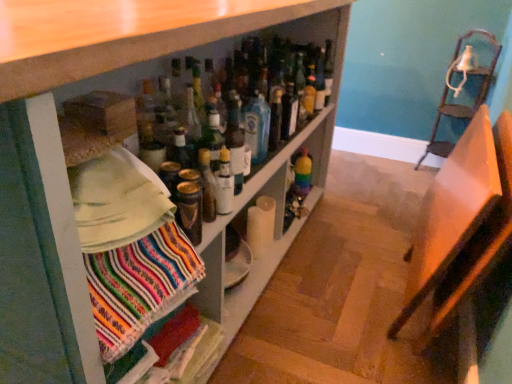
Question: From a real-world perspective, is rainbow glass bottle at center, arranged as the 4th bottle when viewed from the left, located beneath black glass bottle at center, placed as the 2th bottle when sorted from right to left?

Choices:
 (A) yes
 (B) no

Answer: (A)

Question: Can black glass bottle at center, acting as the third bottle starting from the left, be found inside rainbow glass bottle at center, which is the first bottle from right to left?

Choices:
 (A) yes
 (B) no

Answer: (B)

Question: Can you confirm if rainbow glass bottle at center, the 4th bottle viewed from the front, is positioned to the right of black glass bottle at center, which ranks as the second bottle in back-to-front order?

Choices:
 (A) yes
 (B) no

Answer: (A)

Question: From a real-world perspective, is rainbow glass bottle at center, the first bottle in the back-to-front sequence, on black glass bottle at center, which ranks as the second bottle in back-to-front order?

Choices:
 (A) yes
 (B) no

Answer: (B)

Question: Can you confirm if rainbow glass bottle at center, arranged as the 4th bottle when viewed from the left, is wider than black glass bottle at center, which appears as the 3th bottle when viewed from the front?

Choices:
 (A) yes
 (B) no

Answer: (A)

Question: Can you confirm if rainbow glass bottle at center, arranged as the 4th bottle when viewed from the left, is taller than black glass bottle at center, placed as the 2th bottle when sorted from right to left?

Choices:
 (A) yes
 (B) no

Answer: (A)

Question: Is matte white shelf at center further to the viewer compared to black glass bottle at center, acting as the third bottle starting from the left?

Choices:
 (A) yes
 (B) no

Answer: (B)

Question: From the image's perspective, is matte white shelf at center beneath black glass bottle at center, acting as the third bottle starting from the left?

Choices:
 (A) no
 (B) yes

Answer: (B)

Question: Is matte white shelf at center wider than black glass bottle at center, acting as the third bottle starting from the left?

Choices:
 (A) yes
 (B) no

Answer: (A)

Question: Is matte white shelf at center completely or partially outside of black glass bottle at center, placed as the 2th bottle when sorted from right to left?

Choices:
 (A) no
 (B) yes

Answer: (B)

Question: Is matte white shelf at center oriented towards black glass bottle at center, which ranks as the second bottle in back-to-front order?

Choices:
 (A) no
 (B) yes

Answer: (B)

Question: From a real-world perspective, is matte white shelf at center located higher than black glass bottle at center, acting as the third bottle starting from the left?

Choices:
 (A) no
 (B) yes

Answer: (A)

Question: From a real-world perspective, is clear glass bottle at center, which is counted as the second bottle, starting from the front, under metallic gold can at center, which ranks as the 4th bottle in back-to-front order?

Choices:
 (A) no
 (B) yes

Answer: (A)